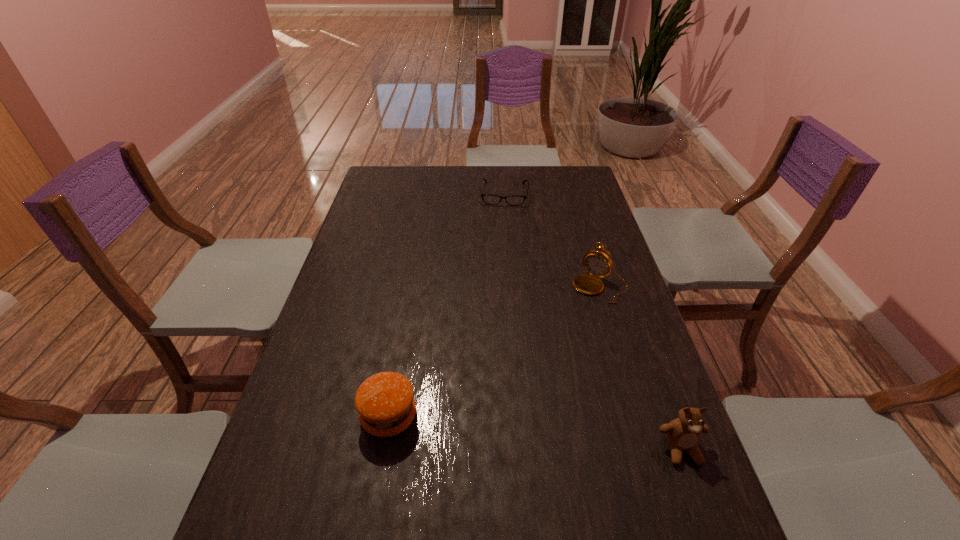
You are a GUI agent. You are given a task and a screenshot of the screen. Output one action in this format:
    pyautogui.click(x=<x>, y=<y>)
    Task: Click on the patty
    The image size is (960, 540).
    Given the screenshot: What is the action you would take?
    pyautogui.click(x=385, y=402)

Where is `the leftmost object`? The width and height of the screenshot is (960, 540). the leftmost object is located at coordinates (385, 402).

Locate an element on the screen. The height and width of the screenshot is (540, 960). teddy bear is located at coordinates (683, 434).

Identify the location of the third nearest object. The image size is (960, 540). (598, 264).

This screenshot has width=960, height=540. I want to click on the second object from left to right, so click(x=515, y=200).

You are a GUI agent. You are given a task and a screenshot of the screen. Output one action in this format:
    pyautogui.click(x=<x>, y=<y>)
    Task: Click on the farthest object
    This screenshot has width=960, height=540.
    Given the screenshot: What is the action you would take?
    pyautogui.click(x=515, y=200)

Where is `blank area located 0.090m on the front of the leftmost object`? Image resolution: width=960 pixels, height=540 pixels. blank area located 0.090m on the front of the leftmost object is located at coordinates (377, 484).

Where is `free space located 0.050m on the front-facing side of the teddy bear`? This screenshot has width=960, height=540. free space located 0.050m on the front-facing side of the teddy bear is located at coordinates (697, 492).

Locate an element on the screen. This screenshot has height=540, width=960. vacant space located 0.160m on the face of the second farthest object is located at coordinates (563, 334).

At what (x,y) coordinates should I click in order to perform the action: click on vacant position located on the face of the second farthest object. Please return your answer as a coordinate pair (x, y). The height and width of the screenshot is (540, 960). Looking at the image, I should click on (569, 325).